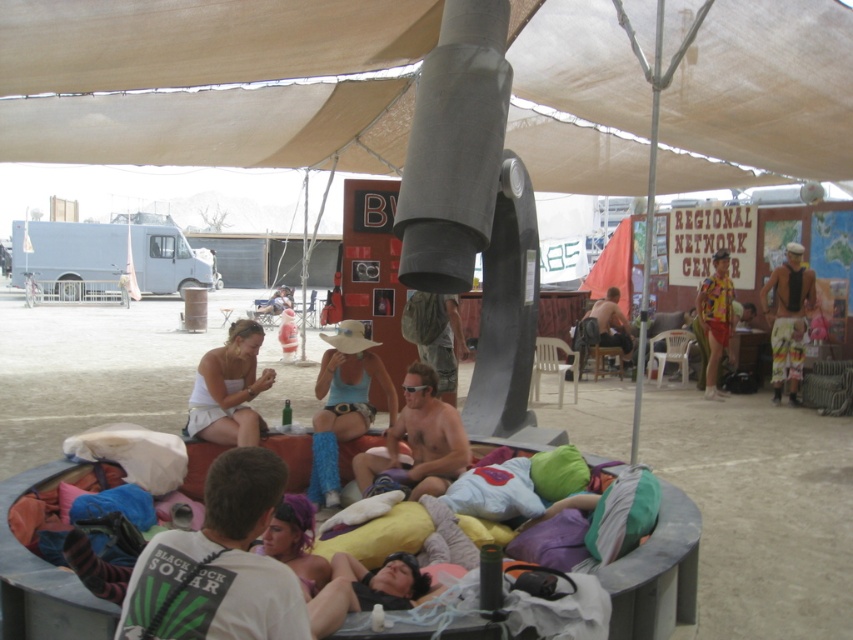
You are standing at the center of the sandy area and looking towards the beige canopy. There is a point marked at coordinates (219,564). What object is located at this point?

The white t shirt at lower center is located at point (219,564).